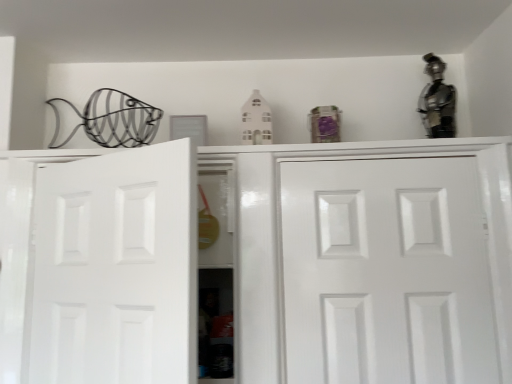
Question: From a real-world perspective, is white glossy door at center, the 2th door in the left-to-right sequence, beneath metallic silver figurine at upper right?

Choices:
 (A) yes
 (B) no

Answer: (A)

Question: Considering the relative positions of white glossy door at center, the 1th door when ordered from right to left, and metallic silver figurine at upper right in the image provided, is white glossy door at center, the 1th door when ordered from right to left, to the left of metallic silver figurine at upper right from the viewer's perspective?

Choices:
 (A) no
 (B) yes

Answer: (B)

Question: Does white glossy door at center, the 1th door when ordered from right to left, lie behind metallic silver figurine at upper right?

Choices:
 (A) no
 (B) yes

Answer: (A)

Question: Is white glossy door at center, the 1th door when ordered from right to left, to the right of metallic silver figurine at upper right from the viewer's perspective?

Choices:
 (A) yes
 (B) no

Answer: (B)

Question: Is white glossy door at center, the 2th door in the left-to-right sequence, oriented away from metallic silver figurine at upper right?

Choices:
 (A) no
 (B) yes

Answer: (A)

Question: Based on their sizes in the image, would you say white glossy door at center, the 1th door when ordered from right to left, is bigger or smaller than white matte door at left, the 2th door positioned from the right?

Choices:
 (A) small
 (B) big

Answer: (B)

Question: From the image's perspective, is white glossy door at center, the 1th door when ordered from right to left, located above or below white matte door at left, arranged as the first door when viewed from the left?

Choices:
 (A) above
 (B) below

Answer: (B)

Question: Is white glossy door at center, the 1th door when ordered from right to left, taller or shorter than white matte door at left, the 2th door positioned from the right?

Choices:
 (A) tall
 (B) short

Answer: (A)

Question: Considering the positions of point (471, 299) and point (95, 359), is point (471, 299) closer or farther from the camera than point (95, 359)?

Choices:
 (A) farther
 (B) closer

Answer: (A)

Question: From a real-world perspective, is white glossy cabinet doors at center above or below white matte door at left, arranged as the first door when viewed from the left?

Choices:
 (A) below
 (B) above

Answer: (A)

Question: Does point (31, 203) appear closer or farther from the camera than point (188, 336)?

Choices:
 (A) closer
 (B) farther

Answer: (B)

Question: Is white glossy cabinet doors at center bigger or smaller than white matte door at left, arranged as the first door when viewed from the left?

Choices:
 (A) big
 (B) small

Answer: (A)

Question: From the image's perspective, is white glossy cabinet doors at center positioned above or below white matte door at left, arranged as the first door when viewed from the left?

Choices:
 (A) above
 (B) below

Answer: (B)

Question: From their relative heights in the image, would you say white glossy door at center, the 2th door in the left-to-right sequence, is taller or shorter than metallic silver figurine at upper right?

Choices:
 (A) tall
 (B) short

Answer: (A)

Question: Based on their positions, is white glossy door at center, the 2th door in the left-to-right sequence, located to the left or right of metallic silver figurine at upper right?

Choices:
 (A) left
 (B) right

Answer: (A)